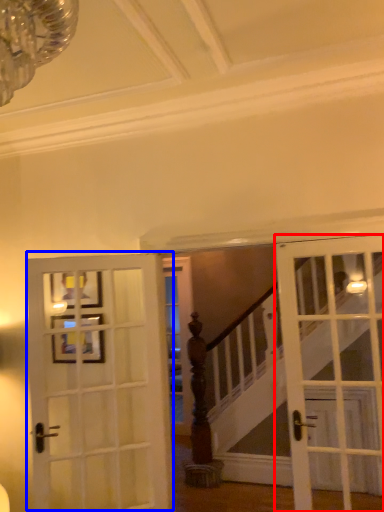
Question: Which object is closer to the camera taking this photo, door (highlighted by a red box) or door (highlighted by a blue box)?

Choices:
 (A) door
 (B) door

Answer: (A)